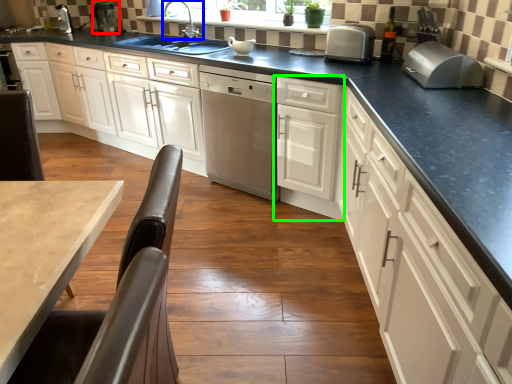
Question: Which is nearer to the appliance (highlighted by a red box)? tap (highlighted by a blue box) or cabinetry (highlighted by a green box).

Choices:
 (A) tap
 (B) cabinetry

Answer: (A)